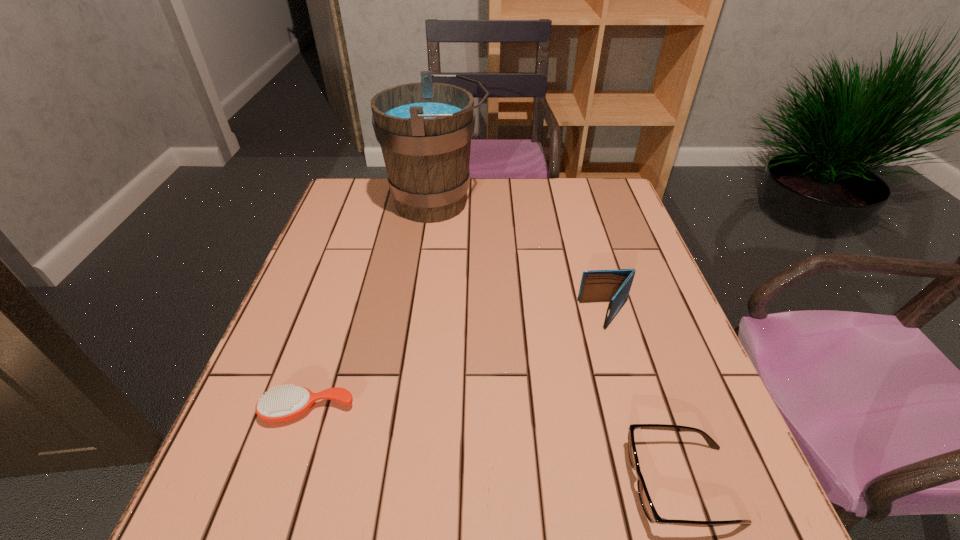
Locate an element on the screen. This screenshot has width=960, height=540. vacant point located between the second nearest object and the nearest object is located at coordinates (495, 448).

Where is `free space between the hairbrush and the wine bucket`? free space between the hairbrush and the wine bucket is located at coordinates (372, 307).

Locate an element on the screen. free space between the spectacles and the shortest object is located at coordinates (495, 448).

Where is `empty space between the second tallest object and the nearest object`? This screenshot has width=960, height=540. empty space between the second tallest object and the nearest object is located at coordinates (644, 400).

This screenshot has height=540, width=960. I want to click on free space between the tallest object and the second shortest object, so click(560, 343).

At what (x,y) coordinates should I click in order to perform the action: click on vacant point located between the wine bucket and the spectacles. Please return your answer as a coordinate pair (x, y). Looking at the image, I should click on (560, 343).

Image resolution: width=960 pixels, height=540 pixels. I want to click on free space between the shortest object and the farthest object, so click(372, 307).

I want to click on vacant region between the third tallest object and the shortest object, so click(495, 448).

I want to click on unoccupied area between the hairbrush and the spectacles, so click(x=495, y=448).

Locate an element on the screen. empty space that is in between the wallet and the wine bucket is located at coordinates point(521,259).